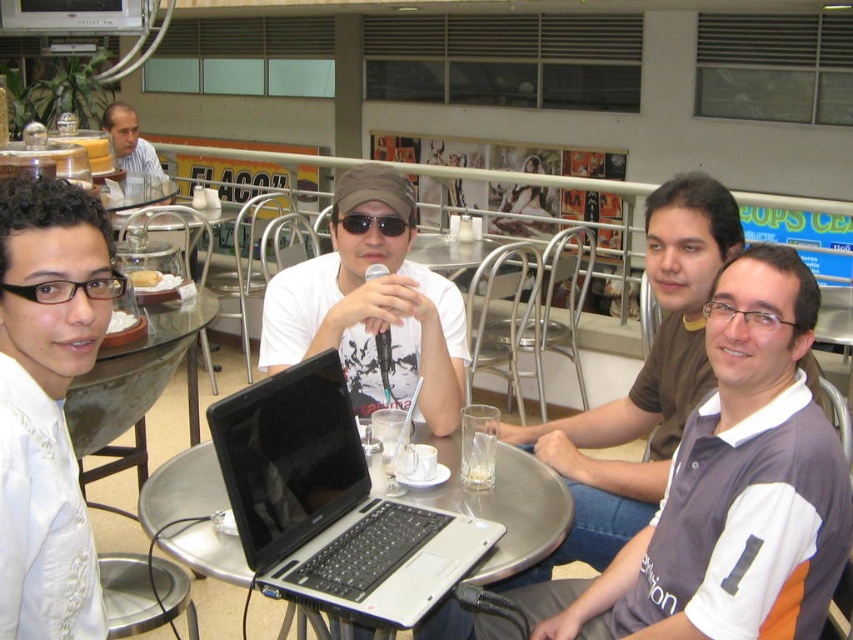
Question: Which object is the closest to the transparent glass table at center?

Choices:
 (A) black matte sunglasses at center
 (B) clear glass at table center
 (C) matte black laptop at center

Answer: (C)

Question: Based on their relative distances, which object is nearer to the transparent glass table at center?

Choices:
 (A) silver/black laptop at center
 (B) gray fabric shirt at upper right

Answer: (A)

Question: Can you confirm if transparent glass table at center is positioned below light brown shirt at upper left?

Choices:
 (A) yes
 (B) no

Answer: (A)

Question: Which point is closer to the camera?

Choices:
 (A) matte black laptop at center
 (B) light brown shirt at upper left
 (C) white satin shirt at left
 (D) clear glass at table center

Answer: (C)

Question: From the image, what is the correct spatial relationship of gray fabric shirt at upper right in relation to clear glass at table center?

Choices:
 (A) above
 (B) below

Answer: (A)

Question: Does white satin shirt at left come in front of transparent glass table at center?

Choices:
 (A) yes
 (B) no

Answer: (A)